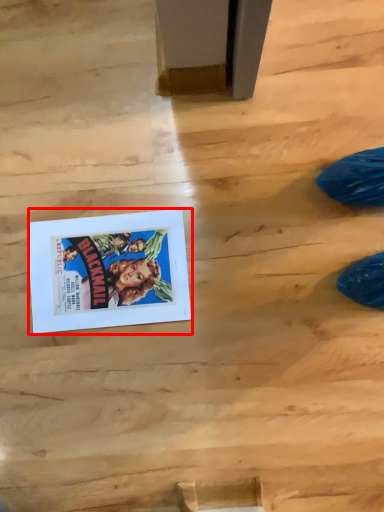
Question: From the image's perspective, what is the correct spatial relationship of comic book (annotated by the red box) in relation to wood?

Choices:
 (A) below
 (B) above

Answer: (B)